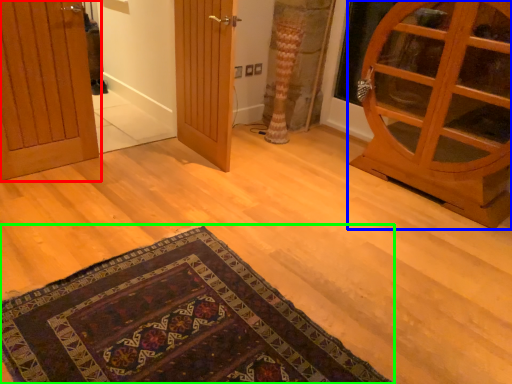
Question: Estimate the real-world distances between objects in this image. Which object is closer to door (highlighted by a red box), door (highlighted by a blue box) or mat (highlighted by a green box)?

Choices:
 (A) door
 (B) mat

Answer: (B)